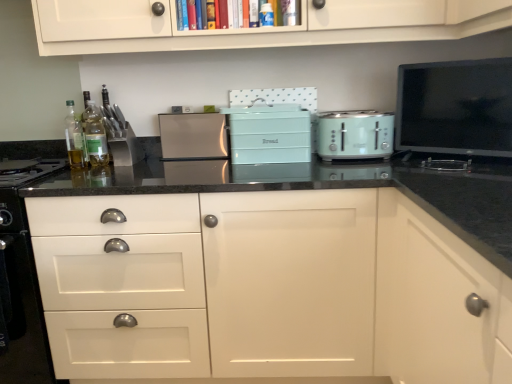
Question: Is mint green plastic toaster at center, the second kitchen appliance in the left-to-right sequence, thinner than matte teal bread bin at center, the second appliance in the right-to-left sequence?

Choices:
 (A) no
 (B) yes

Answer: (B)

Question: Is mint green plastic toaster at center, the second kitchen appliance in the left-to-right sequence, positioned before matte teal bread bin at center, acting as the first appliance starting from the left?

Choices:
 (A) yes
 (B) no

Answer: (A)

Question: Can you confirm if mint green plastic toaster at center, the 1th kitchen appliance viewed from the right, is bigger than matte teal bread bin at center, acting as the first appliance starting from the left?

Choices:
 (A) no
 (B) yes

Answer: (A)

Question: Is mint green plastic toaster at center, marked as the first kitchen appliance in a front-to-back arrangement, positioned with its back to matte teal bread bin at center, the second appliance in the right-to-left sequence?

Choices:
 (A) no
 (B) yes

Answer: (A)

Question: Does mint green plastic toaster at center, the 2th kitchen appliance when ordered from back to front, have a lesser height compared to matte teal bread bin at center, acting as the first appliance starting from the left?

Choices:
 (A) yes
 (B) no

Answer: (A)

Question: Choose the correct answer: Is satin silver toaster at center, which is the second kitchen appliance from front to back, inside white matte cabinet at center or outside it?

Choices:
 (A) inside
 (B) outside

Answer: (A)

Question: Is satin silver toaster at center, the first kitchen appliance viewed from the back, wider or thinner than white matte cabinet at center?

Choices:
 (A) thin
 (B) wide

Answer: (A)

Question: From a real-world perspective, is satin silver toaster at center, which appears as the first kitchen appliance when viewed from the left, above or below white matte cabinet at center?

Choices:
 (A) below
 (B) above

Answer: (B)

Question: Considering their positions, is satin silver toaster at center, which appears as the first kitchen appliance when viewed from the left, located in front of or behind white matte cabinet at center?

Choices:
 (A) behind
 (B) front

Answer: (A)

Question: Is point (358, 140) positioned closer to the camera than point (67, 132)?

Choices:
 (A) farther
 (B) closer

Answer: (B)

Question: Is mint green plastic toaster at center, the 1th kitchen appliance viewed from the right, inside or outside of translucent glass bottle at left, positioned as the 2th bottle in right-to-left order?

Choices:
 (A) inside
 (B) outside

Answer: (B)

Question: From a real-world perspective, relative to translucent glass bottle at left, the 1th bottle in the left-to-right sequence, is mint green plastic toaster at center, marked as the first kitchen appliance in a front-to-back arrangement, vertically above or below?

Choices:
 (A) below
 (B) above

Answer: (A)

Question: Is mint green plastic toaster at center, marked as the first kitchen appliance in a front-to-back arrangement, in front of or behind translucent glass bottle at left, positioned as the 2th bottle in right-to-left order, in the image?

Choices:
 (A) front
 (B) behind

Answer: (A)

Question: Considering the relative positions of white glossy drawer at lower left and white matte cabinet at center in the image provided, is white glossy drawer at lower left to the left or to the right of white matte cabinet at center?

Choices:
 (A) left
 (B) right

Answer: (A)

Question: From their relative heights in the image, would you say white glossy drawer at lower left is taller or shorter than white matte cabinet at center?

Choices:
 (A) short
 (B) tall

Answer: (A)